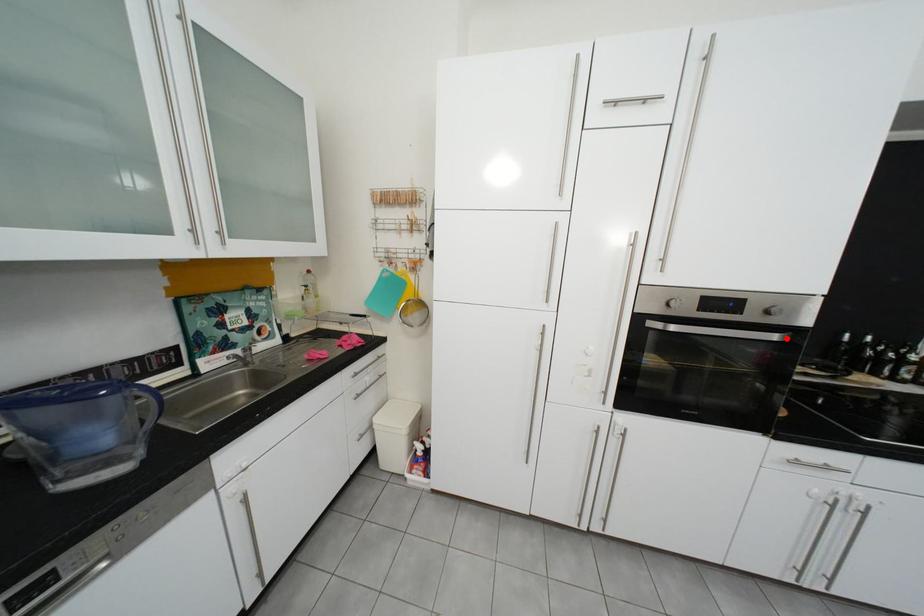
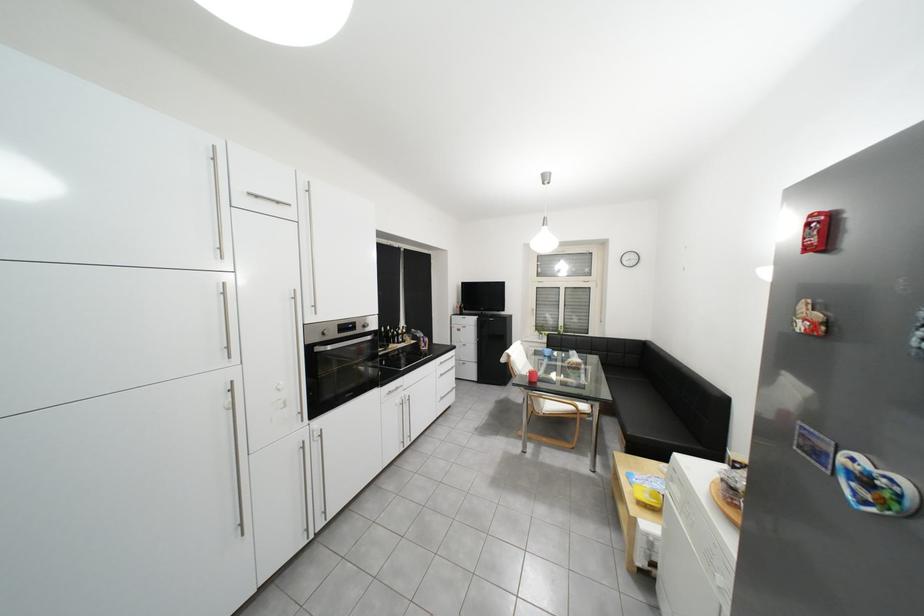
Question: I am providing you with two images of the same scene from different viewpoints. A red point is shown in image1. For the corresponding object point in image2, is it positioned nearer or farther from the camera?

Choices:
 (A) Nearer
 (B) Farther

Answer: (A)